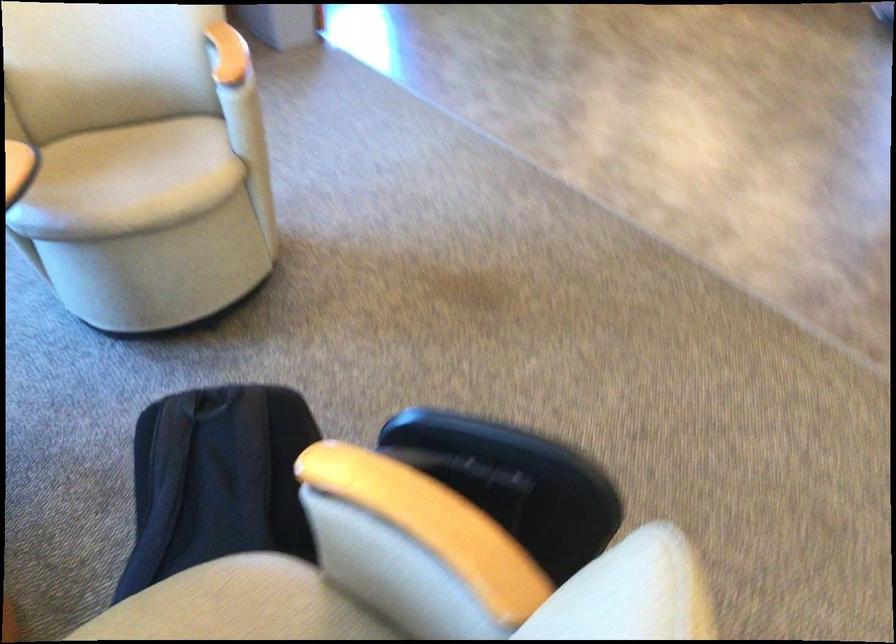
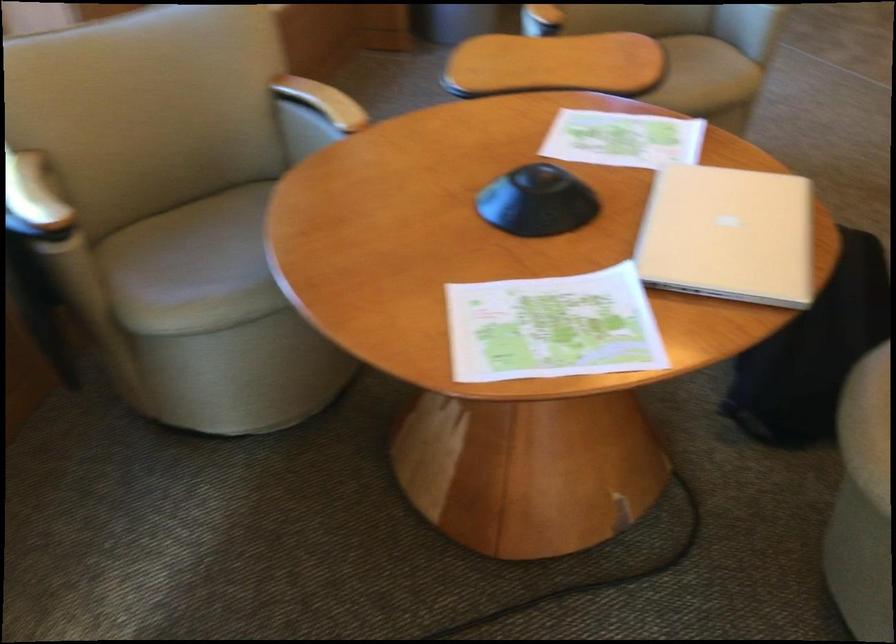
Find the pixel in the second image that matches the point at 168,190 in the first image.

(703, 76)